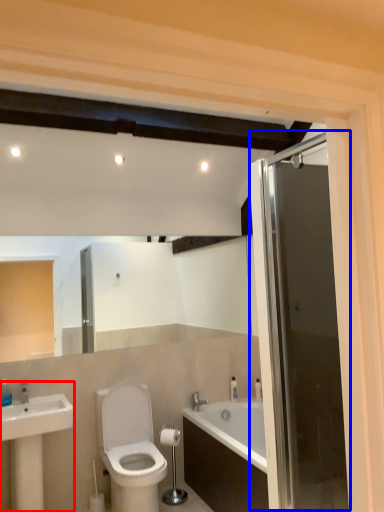
Question: Which point is further to the camera, sink (highlighted by a red box) or door (highlighted by a blue box)?

Choices:
 (A) sink
 (B) door

Answer: (A)